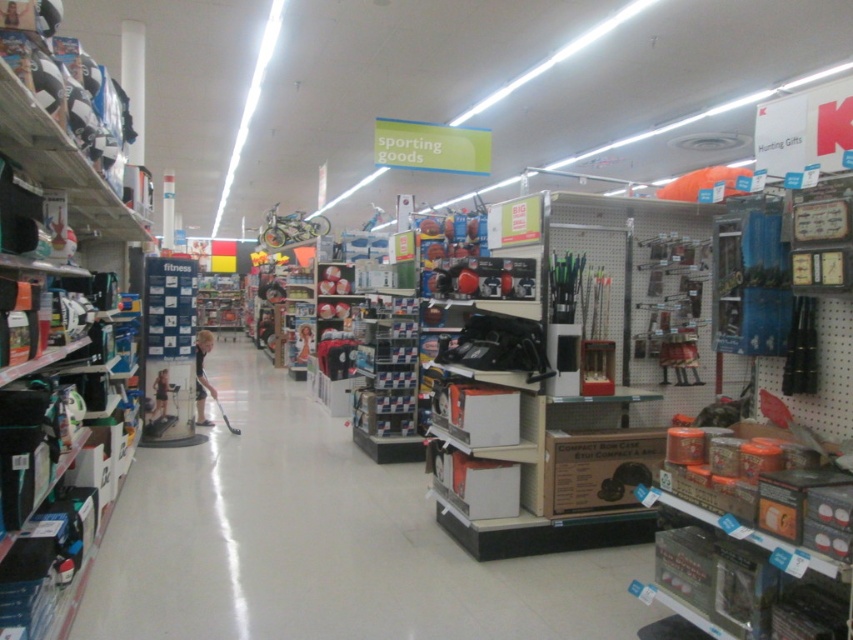
Which of these two, matte black hockey stick at center or white plastic shelves at left, stands shorter?

matte black hockey stick at center is shorter.

Is matte black hockey stick at center further to the viewer compared to white plastic shelves at left?

Yes, matte black hockey stick at center is further from the viewer.

The image size is (853, 640). Describe the element at coordinates (320, 541) in the screenshot. I see `matte black hockey stick at center` at that location.

Locate an element on the screen. The width and height of the screenshot is (853, 640). matte black hockey stick at center is located at coordinates click(320, 541).

How distant is matte black hockey stick at center from dark blue shirt at center?

7.50 feet

Who is shorter, matte black hockey stick at center or dark blue shirt at center?

matte black hockey stick at center is shorter.

This screenshot has height=640, width=853. I want to click on matte black hockey stick at center, so click(x=320, y=541).

What do you see at coordinates (57, 301) in the screenshot? I see `white plastic shelves at left` at bounding box center [57, 301].

This screenshot has height=640, width=853. I want to click on white plastic shelves at left, so click(x=57, y=301).